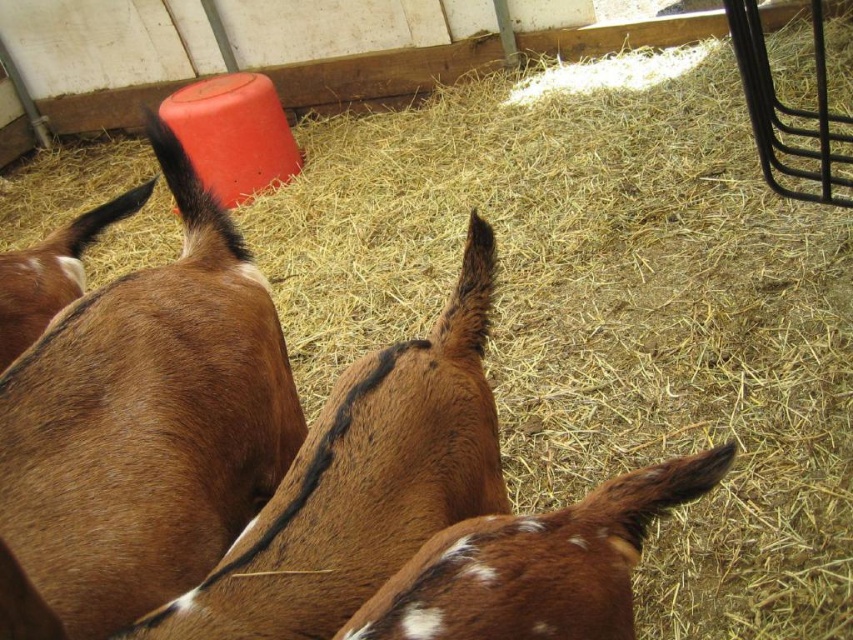
Is brown fuzzy goat at upper left smaller than brown furry goat at upper left?

Incorrect, brown fuzzy goat at upper left is not smaller in size than brown furry goat at upper left.

Is brown fuzzy goat at upper left positioned behind brown furry goat at upper left?

No.

This screenshot has width=853, height=640. What are the coordinates of `brown fuzzy goat at upper left` in the screenshot? It's located at (142, 429).

You are a GUI agent. You are given a task and a screenshot of the screen. Output one action in this format:
    pyautogui.click(x=<x>, y=<y>)
    Task: Click on the brown fuzzy goat at upper left
    The image size is (853, 640).
    Given the screenshot: What is the action you would take?
    pyautogui.click(x=142, y=429)

Is brown speckled fur at center below brown furry goat at upper left?

Indeed, brown speckled fur at center is positioned under brown furry goat at upper left.

Who is positioned more to the left, brown speckled fur at center or brown furry goat at upper left?

From the viewer's perspective, brown furry goat at upper left appears more on the left side.

Does point (480, 620) come farther from viewer compared to point (50, 310)?

That is False.

The image size is (853, 640). In order to click on brown speckled fur at center in this screenshot , I will do `click(537, 564)`.

Can you confirm if brown furry goat at center is bigger than brown speckled fur at center?

Yes.

Is brown furry goat at center smaller than brown speckled fur at center?

No, brown furry goat at center is not smaller than brown speckled fur at center.

Locate an element on the screen. The height and width of the screenshot is (640, 853). brown furry goat at center is located at coordinates (363, 483).

Identify the location of brown furry goat at center. This screenshot has width=853, height=640. (363, 483).